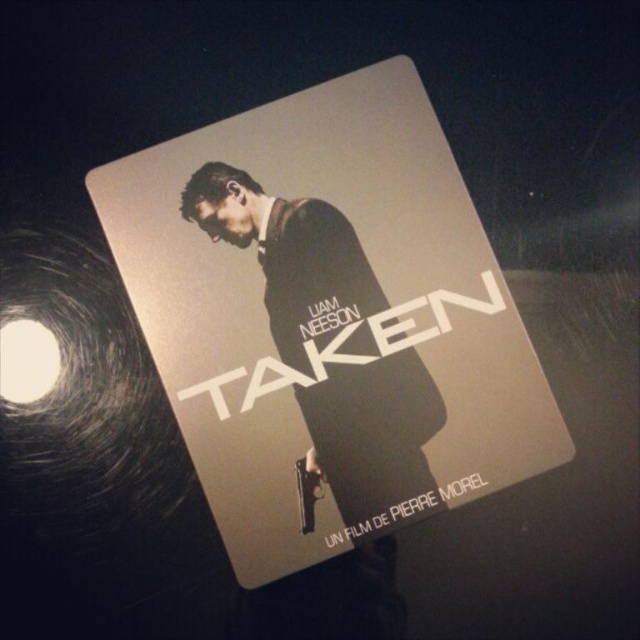
You are designing a display case for a movie memorabilia exhibition. The display case has a width of 1.5 inches. You need to place both the metallic silver book at center and the matte black suit at center inside the case. Can both items fit side by side within the display case?

The metallic silver book at center and the matte black suit at center are 1.32 inches apart from each other. Since the display case is 1.5 inches wide, there is enough space to fit both items side by side as the combined width of the items plus the space between them is less than the case width.

You are organizing a movie night and need to place the metallic silver book at center and the matte black suit at center on a shelf. According to the image, which object should be placed higher on the shelf?

The metallic silver book at center should be placed higher on the shelf since it is positioned above the matte black suit at center in the image.

You are holding the steelbook cover of the movie Taken. You want to place a sticker on the point that is closer to the viewer. Which point should you choose between point (435, 275) and point (240, 188)?

Point (435, 275) is in front of point (240, 188), so you should choose point (435, 275) to place the sticker.